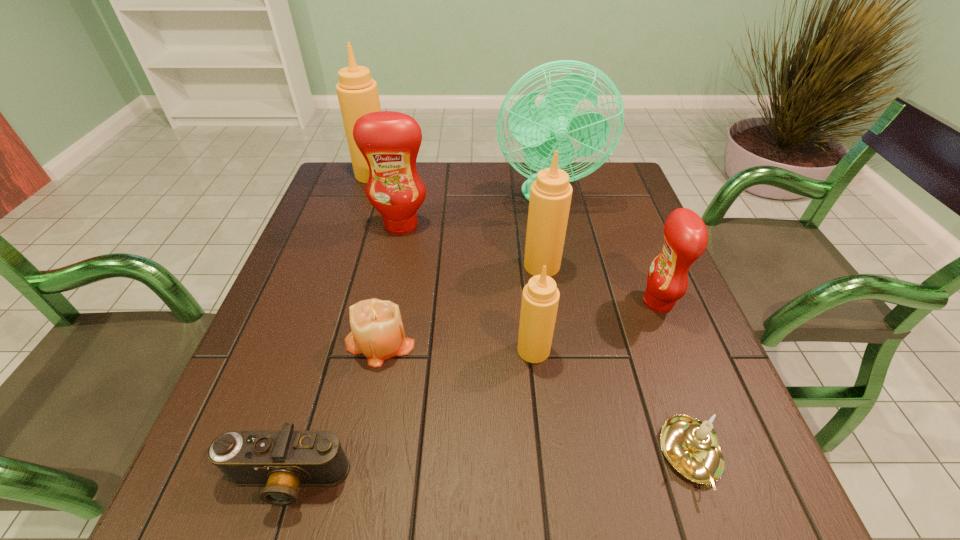
The height and width of the screenshot is (540, 960). Find the location of `vacant space at the near right corner of the desktop`. vacant space at the near right corner of the desktop is located at coordinates tap(733, 491).

Where is `free space between the rightmost condiment and the farthest tan condiment`? free space between the rightmost condiment and the farthest tan condiment is located at coordinates (516, 238).

You are a GUI agent. You are given a task and a screenshot of the screen. Output one action in this format:
    pyautogui.click(x=<x>, y=<y>)
    Task: Click on the free area in between the biggest tan condiment and the rightmost condiment
    The height and width of the screenshot is (540, 960).
    Given the screenshot: What is the action you would take?
    pyautogui.click(x=516, y=238)

The height and width of the screenshot is (540, 960). What are the coordinates of `free space between the nearest tan condiment and the fourth nearest condiment` in the screenshot? It's located at (468, 287).

Image resolution: width=960 pixels, height=540 pixels. I want to click on vacant space that's between the fan and the candle holder, so pyautogui.click(x=620, y=326).

This screenshot has width=960, height=540. In order to click on vacant space that's between the second nearest condiment and the candle in this screenshot , I will do `click(518, 322)`.

The height and width of the screenshot is (540, 960). Find the location of `vacant space that is in between the fourth nearest condiment and the second smallest tan condiment`. vacant space that is in between the fourth nearest condiment and the second smallest tan condiment is located at coordinates (471, 245).

Locate an element on the screen. The image size is (960, 540). vacant space that is in between the second farthest tan condiment and the candle is located at coordinates (x=461, y=303).

Where is `vacant area that lies between the candle holder and the beige candle`? vacant area that lies between the candle holder and the beige candle is located at coordinates (536, 399).

I want to click on vacant area between the blue fan and the shortest object, so click(417, 338).